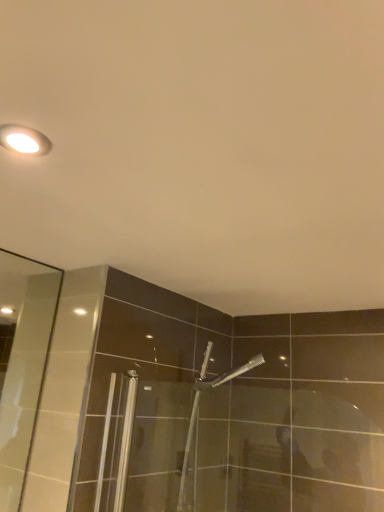
Question: Is the position of matte white light fixture at upper left more distant than that of silver metallic shower head at center?

Choices:
 (A) yes
 (B) no

Answer: (B)

Question: Is matte white light fixture at upper left positioned beyond the bounds of silver metallic shower head at center?

Choices:
 (A) no
 (B) yes

Answer: (B)

Question: Is matte white light fixture at upper left wider than silver metallic shower head at center?

Choices:
 (A) no
 (B) yes

Answer: (A)

Question: Is matte white light fixture at upper left bigger than silver metallic shower head at center?

Choices:
 (A) no
 (B) yes

Answer: (A)

Question: From a real-world perspective, is matte white light fixture at upper left located higher than silver metallic shower head at center?

Choices:
 (A) no
 (B) yes

Answer: (B)

Question: Does matte white light fixture at upper left turn towards silver metallic shower head at center?

Choices:
 (A) yes
 (B) no

Answer: (B)

Question: Considering the relative sizes of silver metallic shower head at center and matte white light fixture at upper left in the image provided, is silver metallic shower head at center shorter than matte white light fixture at upper left?

Choices:
 (A) no
 (B) yes

Answer: (A)

Question: Can you confirm if silver metallic shower head at center is positioned to the right of matte white light fixture at upper left?

Choices:
 (A) no
 (B) yes

Answer: (B)

Question: From the image's perspective, is silver metallic shower head at center below matte white light fixture at upper left?

Choices:
 (A) no
 (B) yes

Answer: (B)

Question: From the image's perspective, would you say silver metallic shower head at center is positioned over matte white light fixture at upper left?

Choices:
 (A) yes
 (B) no

Answer: (B)

Question: From a real-world perspective, is silver metallic shower head at center located beneath matte white light fixture at upper left?

Choices:
 (A) yes
 (B) no

Answer: (A)

Question: Is silver metallic shower head at center positioned with its back to matte white light fixture at upper left?

Choices:
 (A) no
 (B) yes

Answer: (A)

Question: Considering the relative positions of silver metallic shower head at center and matte white light fixture at upper left in the image provided, is silver metallic shower head at center to the left or to the right of matte white light fixture at upper left?

Choices:
 (A) right
 (B) left

Answer: (A)